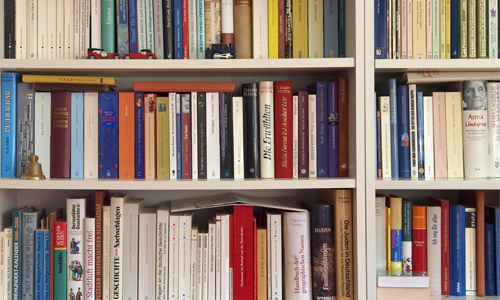
Where is `yellow books`? The image size is (500, 300). yellow books is located at coordinates (272, 42), (295, 39), (441, 44), (450, 42), (71, 76).